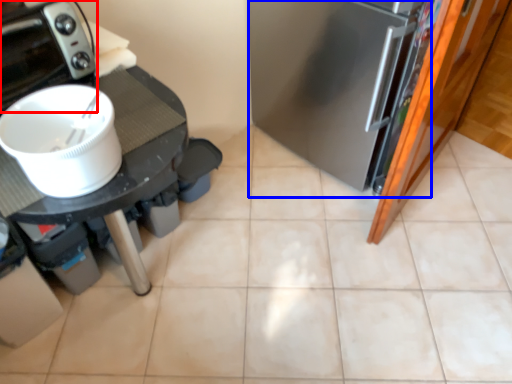
Question: Which of the following is the farthest to the observer, home appliance (highlighted by a red box) or fridge (highlighted by a blue box)?

Choices:
 (A) home appliance
 (B) fridge

Answer: (B)